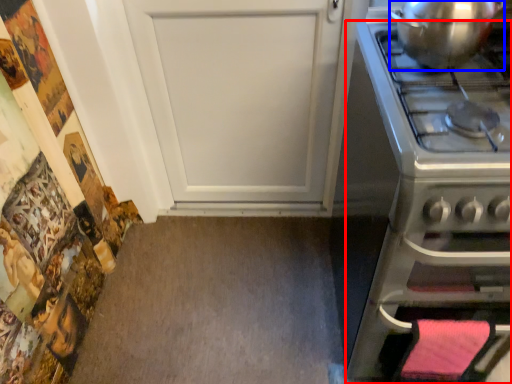
Question: Which object appears closest to the camera in this image, oven (highlighted by a red box) or kitchen appliance (highlighted by a blue box)?

Choices:
 (A) oven
 (B) kitchen appliance

Answer: (A)